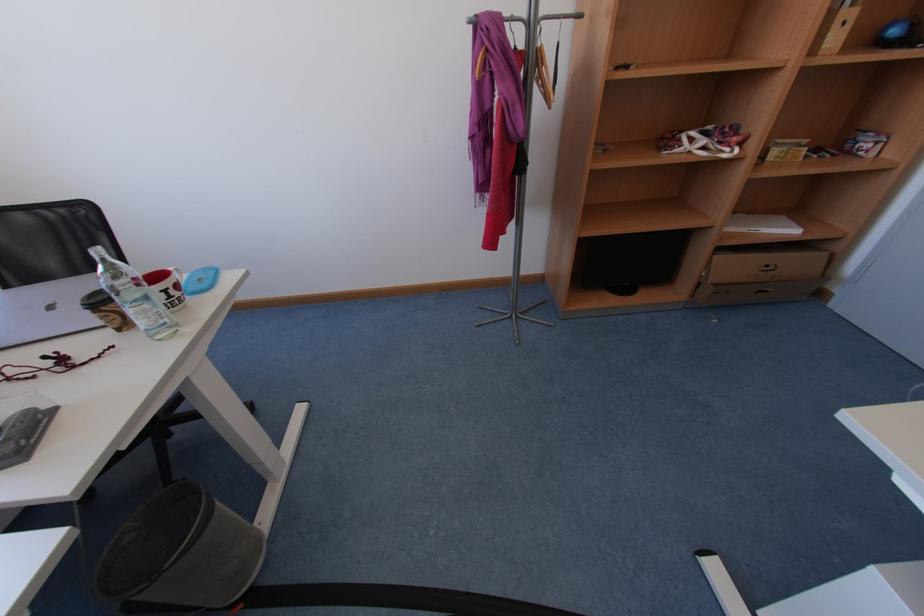
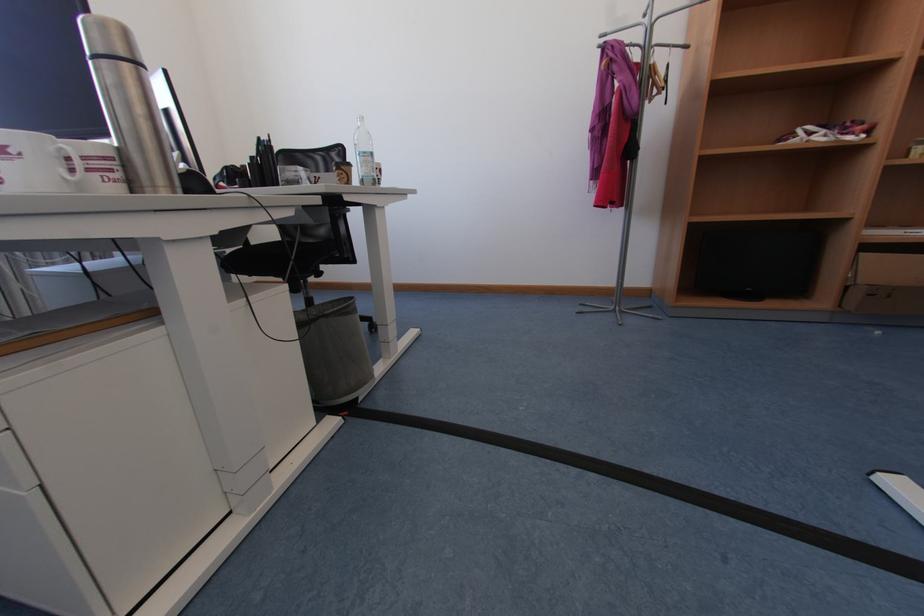
In the second image, find the point that corresponds to [708,285] in the first image.

(855, 289)